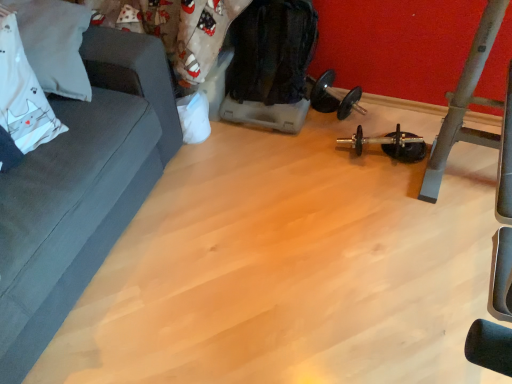
Question: Is black rubber dumbbell at center positioned with its back to white fabric pillow at upper left?

Choices:
 (A) no
 (B) yes

Answer: (A)

Question: From the image's perspective, would you say black rubber dumbbell at center is shown under white fabric pillow at upper left?

Choices:
 (A) yes
 (B) no

Answer: (A)

Question: Does black rubber dumbbell at center turn towards white fabric pillow at upper left?

Choices:
 (A) yes
 (B) no

Answer: (B)

Question: Is black rubber dumbbell at center thinner than white fabric pillow at upper left?

Choices:
 (A) yes
 (B) no

Answer: (A)

Question: Is white fabric pillow at upper left a part of black rubber dumbbell at center?

Choices:
 (A) yes
 (B) no

Answer: (B)

Question: Is white fabric pillow at upper left in front of or behind dark gray fabric couch at left in the image?

Choices:
 (A) front
 (B) behind

Answer: (B)

Question: From the image's perspective, is white fabric pillow at upper left located above or below dark gray fabric couch at left?

Choices:
 (A) above
 (B) below

Answer: (A)

Question: Which is correct: white fabric pillow at upper left is inside dark gray fabric couch at left, or outside of it?

Choices:
 (A) inside
 (B) outside

Answer: (A)

Question: From their relative heights in the image, would you say white fabric pillow at upper left is taller or shorter than dark gray fabric couch at left?

Choices:
 (A) tall
 (B) short

Answer: (B)

Question: From the image's perspective, is black rubber dumbbell at center above or below white fabric pillow at upper left?

Choices:
 (A) below
 (B) above

Answer: (A)

Question: Is black rubber dumbbell at center wider or thinner than white fabric pillow at upper left?

Choices:
 (A) wide
 (B) thin

Answer: (B)

Question: Is point (355, 132) positioned closer to the camera than point (74, 59)?

Choices:
 (A) farther
 (B) closer

Answer: (A)

Question: Based on their sizes in the image, would you say black rubber dumbbell at center is bigger or smaller than white fabric pillow at upper left?

Choices:
 (A) small
 (B) big

Answer: (A)

Question: From their relative heights in the image, would you say dark gray fabric couch at left is taller or shorter than black rubber dumbbell at center?

Choices:
 (A) short
 (B) tall

Answer: (B)

Question: From a real-world perspective, relative to black rubber dumbbell at center, is dark gray fabric couch at left vertically above or below?

Choices:
 (A) below
 (B) above

Answer: (B)